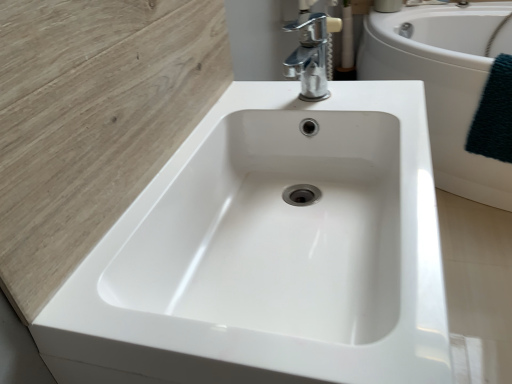
Question: Considering the relative sizes of chrome metallic faucet at upper center and white glossy bathtub at center in the image provided, is chrome metallic faucet at upper center bigger than white glossy bathtub at center?

Choices:
 (A) no
 (B) yes

Answer: (A)

Question: Is chrome metallic faucet at upper center behind white glossy bathtub at center?

Choices:
 (A) no
 (B) yes

Answer: (A)

Question: Considering the relative sizes of chrome metallic faucet at upper center and white glossy bathtub at center in the image provided, is chrome metallic faucet at upper center thinner than white glossy bathtub at center?

Choices:
 (A) yes
 (B) no

Answer: (A)

Question: Is chrome metallic faucet at upper center at the right side of white glossy bathtub at center?

Choices:
 (A) no
 (B) yes

Answer: (A)

Question: Is chrome metallic faucet at upper center beside white glossy bathtub at center?

Choices:
 (A) no
 (B) yes

Answer: (A)

Question: In terms of height, does white glossy bathtub at center look taller or shorter compared to chrome metallic faucet at upper center?

Choices:
 (A) short
 (B) tall

Answer: (B)

Question: Considering the relative positions of white glossy bathtub at center and chrome metallic faucet at upper center in the image provided, is white glossy bathtub at center to the left or to the right of chrome metallic faucet at upper center?

Choices:
 (A) right
 (B) left

Answer: (A)

Question: From the image's perspective, is white glossy bathtub at center above or below chrome metallic faucet at upper center?

Choices:
 (A) below
 (B) above

Answer: (B)

Question: From a real-world perspective, is white glossy bathtub at center physically located above or below chrome metallic faucet at upper center?

Choices:
 (A) above
 (B) below

Answer: (B)

Question: Considering the positions of point (362, 49) and point (265, 192), is point (362, 49) closer or farther from the camera than point (265, 192)?

Choices:
 (A) farther
 (B) closer

Answer: (A)

Question: Is white glossy bathtub at center to the left or to the right of white glossy sink at center in the image?

Choices:
 (A) left
 (B) right

Answer: (B)

Question: In terms of size, does white glossy bathtub at center appear bigger or smaller than white glossy sink at center?

Choices:
 (A) small
 (B) big

Answer: (B)

Question: Considering the positions of white glossy bathtub at center and white glossy sink at center in the image, is white glossy bathtub at center taller or shorter than white glossy sink at center?

Choices:
 (A) short
 (B) tall

Answer: (B)

Question: Is white glossy bathtub at center wider or thinner than dark green textured towel at right?

Choices:
 (A) wide
 (B) thin

Answer: (A)

Question: In the image, is white glossy bathtub at center on the left side or the right side of dark green textured towel at right?

Choices:
 (A) right
 (B) left

Answer: (B)